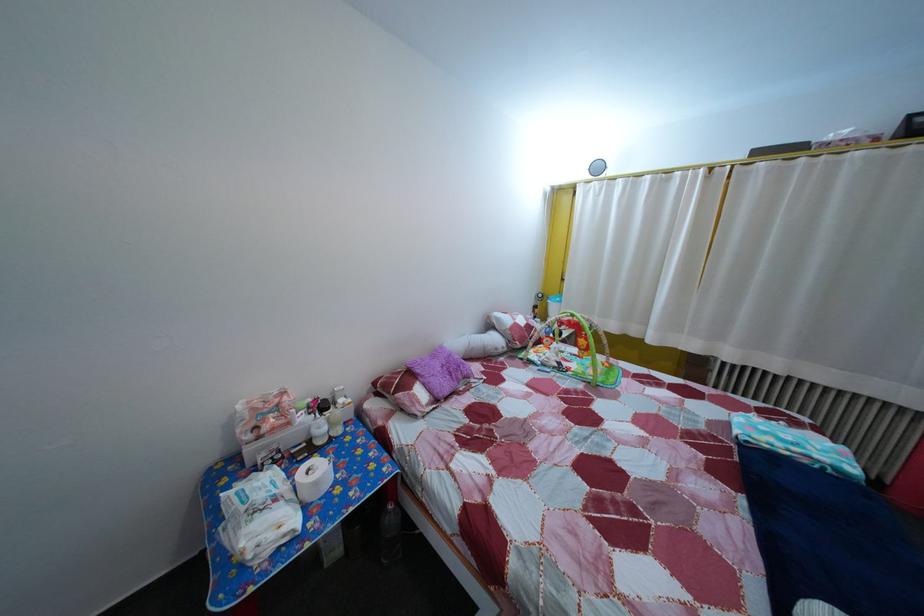
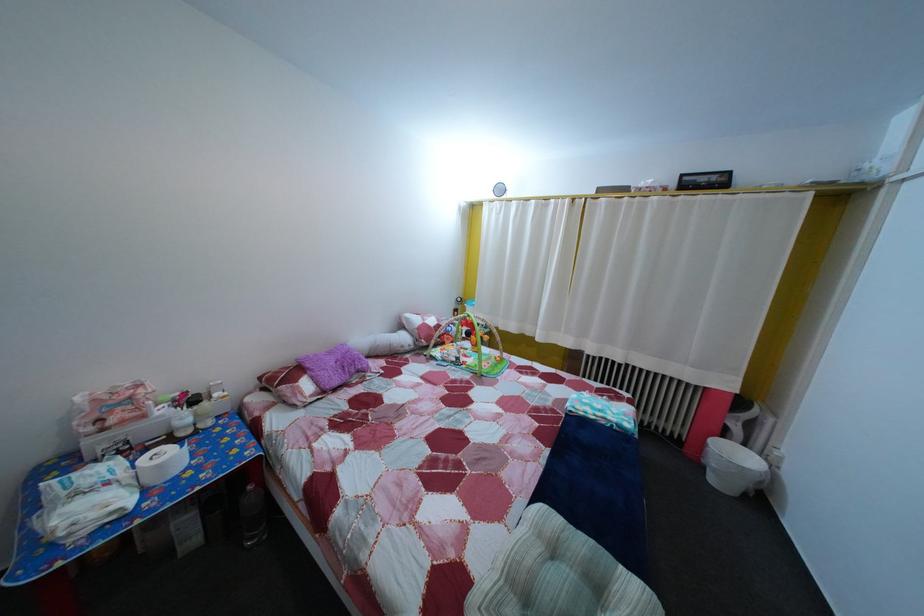
In a continuous first-person perspective shot, in which direction is the camera moving?

The movement direction of the cameraman is right, backward.